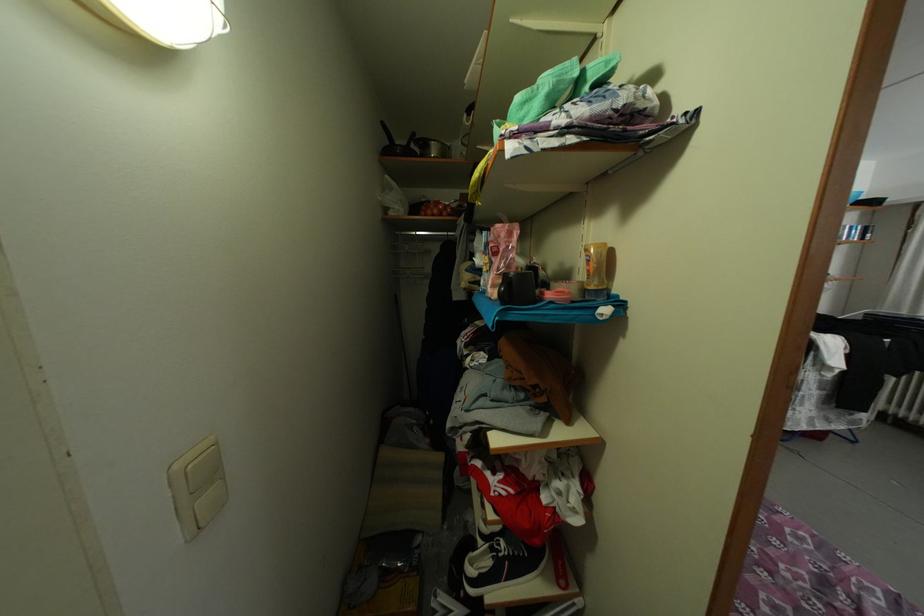
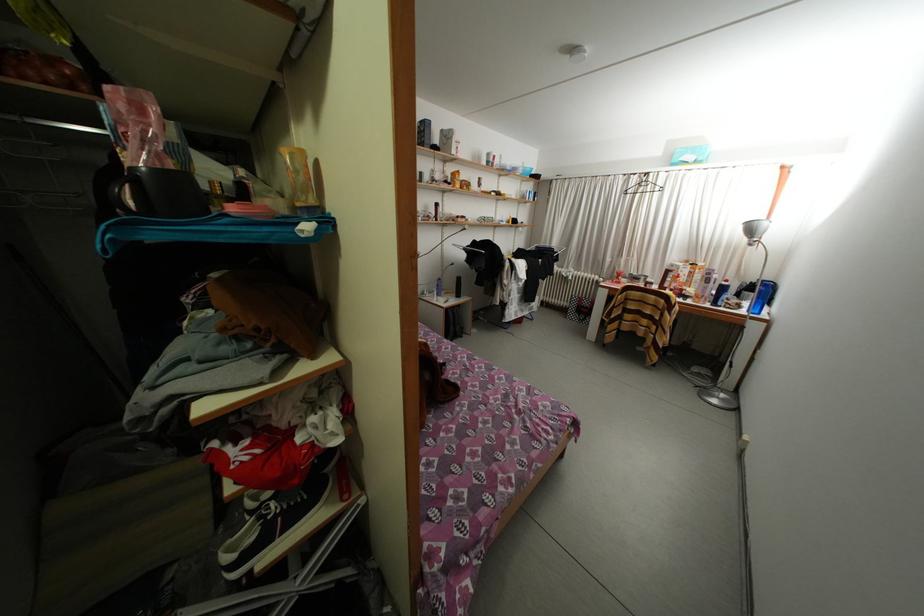
The point at (500, 554) is marked in the first image. Where is the corresponding point in the second image?

(268, 523)